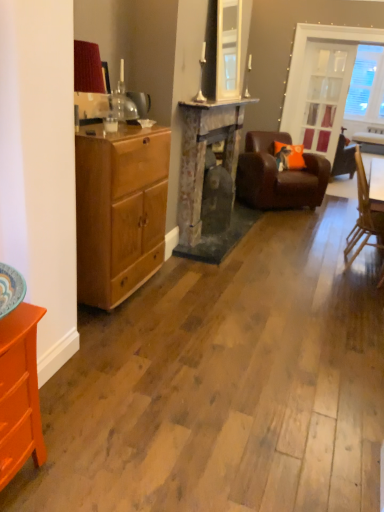
You are a GUI agent. You are given a task and a screenshot of the screen. Output one action in this format:
    pyautogui.click(x=<x>, y=<y>)
    Task: Click on the vacant area situated below orange painted wood dresser at lower left (from a real-world perspective)
    
    Given the screenshot: What is the action you would take?
    [23, 483]